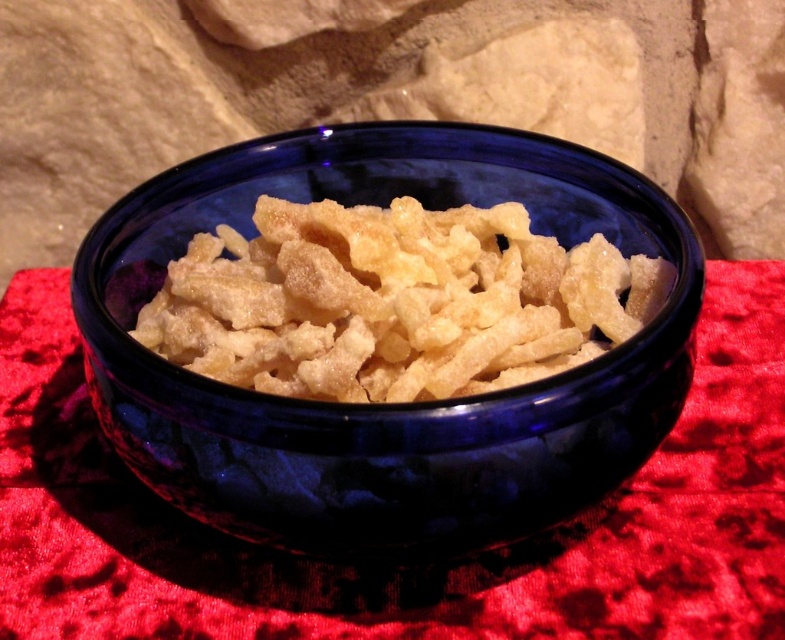
Question: Is glossy ceramic bowl at center to the left of matte yellow cereal at center from the viewer's perspective?

Choices:
 (A) yes
 (B) no

Answer: (A)

Question: Can you confirm if glossy ceramic bowl at center is thinner than matte yellow cereal at center?

Choices:
 (A) yes
 (B) no

Answer: (B)

Question: Can you confirm if glossy ceramic bowl at center is positioned to the right of matte yellow cereal at center?

Choices:
 (A) no
 (B) yes

Answer: (A)

Question: Which point appears closest to the camera in this image?

Choices:
 (A) (179, 355)
 (B) (162, 173)

Answer: (A)

Question: Among these objects, which one is nearest to the camera?

Choices:
 (A) matte yellow cereal at center
 (B) glossy ceramic bowl at center

Answer: (B)